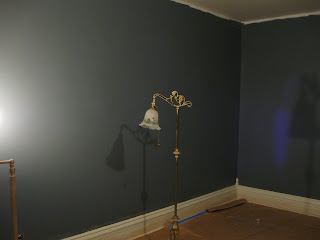
Find the location of a particular element. wood floor is located at coordinates (242, 222).